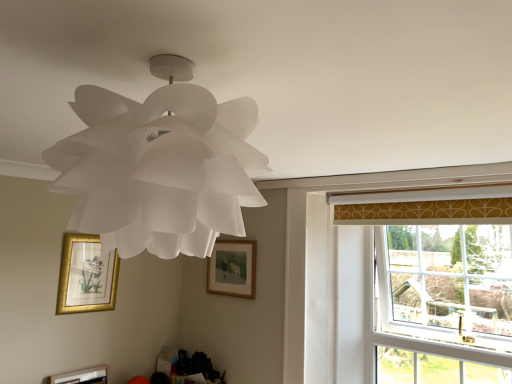
Question: Is wooden framed picture at center, which is counted as the third picture frame, starting from the bottom, outside wooden picture frame at lower left, arranged as the 1th picture frame when ordered from the bottom?

Choices:
 (A) yes
 (B) no

Answer: (A)

Question: Is wooden framed picture at center, which is counted as the third picture frame, starting from the bottom, taller than wooden picture frame at lower left, arranged as the 1th picture frame when ordered from the bottom?

Choices:
 (A) yes
 (B) no

Answer: (A)

Question: Is wooden framed picture at center, the first picture frame viewed from the right, bigger than wooden picture frame at lower left, which is the 3th picture frame from top to bottom?

Choices:
 (A) no
 (B) yes

Answer: (A)

Question: Is wooden framed picture at center, the 1th picture frame when ordered from top to bottom, smaller than wooden picture frame at lower left, which is the 3th picture frame from top to bottom?

Choices:
 (A) no
 (B) yes

Answer: (B)

Question: Is wooden framed picture at center, the first picture frame viewed from the right, aimed at wooden picture frame at lower left, which is the 3th picture frame from top to bottom?

Choices:
 (A) no
 (B) yes

Answer: (A)

Question: Is wooden framed picture at center, the 1th picture frame when ordered from top to bottom, taller or shorter than wooden picture frame at lower left, which appears as the 1th picture frame when viewed from the left?

Choices:
 (A) tall
 (B) short

Answer: (A)

Question: Is wooden framed picture at center, the 3th picture frame from the left, bigger or smaller than wooden picture frame at lower left, arranged as the 1th picture frame when ordered from the bottom?

Choices:
 (A) small
 (B) big

Answer: (A)

Question: From a real-world perspective, relative to wooden picture frame at lower left, which appears as the 3th picture frame when viewed from the right, is wooden framed picture at center, the first picture frame viewed from the right, vertically above or below?

Choices:
 (A) below
 (B) above

Answer: (B)

Question: In terms of width, does wooden framed picture at center, the 3th picture frame from the left, look wider or thinner when compared to wooden picture frame at lower left, which appears as the 1th picture frame when viewed from the left?

Choices:
 (A) wide
 (B) thin

Answer: (B)

Question: From a real-world perspective, is gold framed picture at lower left, which ranks as the 2th picture frame in left-to-right order, physically located above or below white paper lamp at upper center?

Choices:
 (A) above
 (B) below

Answer: (B)

Question: Considering the relative positions of gold framed picture at lower left, placed as the 2th picture frame when sorted from bottom to top, and white paper lamp at upper center in the image provided, is gold framed picture at lower left, placed as the 2th picture frame when sorted from bottom to top, to the left or to the right of white paper lamp at upper center?

Choices:
 (A) right
 (B) left

Answer: (B)

Question: Relative to white paper lamp at upper center, is gold framed picture at lower left, which is counted as the second picture frame, starting from the right, in front or behind?

Choices:
 (A) behind
 (B) front

Answer: (A)

Question: Is gold framed picture at lower left, placed as the 2th picture frame when sorted from bottom to top, wider or thinner than white paper lamp at upper center?

Choices:
 (A) thin
 (B) wide

Answer: (A)

Question: From a real-world perspective, is white paper lamp at upper center positioned above or below gold framed picture at lower left, placed as the 2th picture frame when sorted from bottom to top?

Choices:
 (A) below
 (B) above

Answer: (B)

Question: Considering the positions of point (214, 210) and point (81, 279), is point (214, 210) closer or farther from the camera than point (81, 279)?

Choices:
 (A) farther
 (B) closer

Answer: (B)